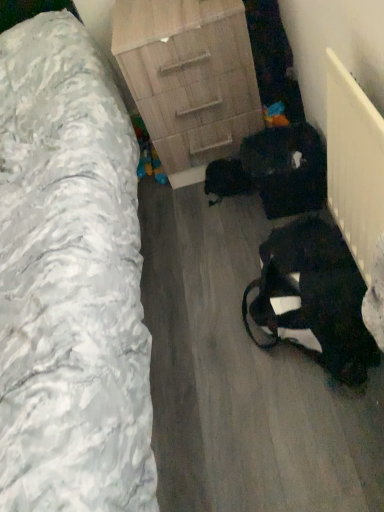
Identify the location of vacant space behind black fabric bag at lower right. Image resolution: width=384 pixels, height=512 pixels. (209, 249).